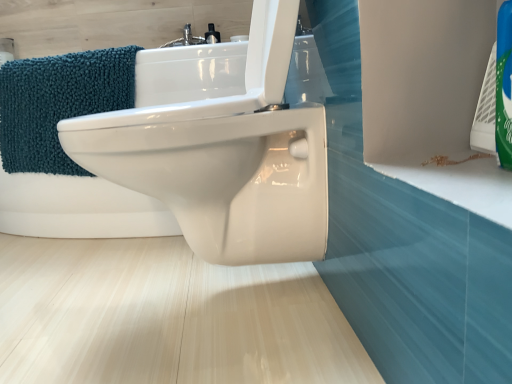
Question: Considering the positions of white glossy bidet at center and teal chenille bath towel at left in the image, is white glossy bidet at center bigger or smaller than teal chenille bath towel at left?

Choices:
 (A) small
 (B) big

Answer: (B)

Question: Does point (174, 233) appear closer or farther from the camera than point (105, 52)?

Choices:
 (A) farther
 (B) closer

Answer: (A)

Question: In terms of width, does white glossy bidet at center look wider or thinner when compared to teal chenille bath towel at left?

Choices:
 (A) thin
 (B) wide

Answer: (B)

Question: Considering the positions of teal chenille bath towel at left and white glossy bidet at center in the image, is teal chenille bath towel at left bigger or smaller than white glossy bidet at center?

Choices:
 (A) small
 (B) big

Answer: (A)

Question: From their relative heights in the image, would you say teal chenille bath towel at left is taller or shorter than white glossy bidet at center?

Choices:
 (A) short
 (B) tall

Answer: (A)

Question: From the image's perspective, is teal chenille bath towel at left located above or below white glossy bidet at center?

Choices:
 (A) above
 (B) below

Answer: (B)

Question: Is teal chenille bath towel at left inside or outside of white glossy bidet at center?

Choices:
 (A) outside
 (B) inside

Answer: (B)